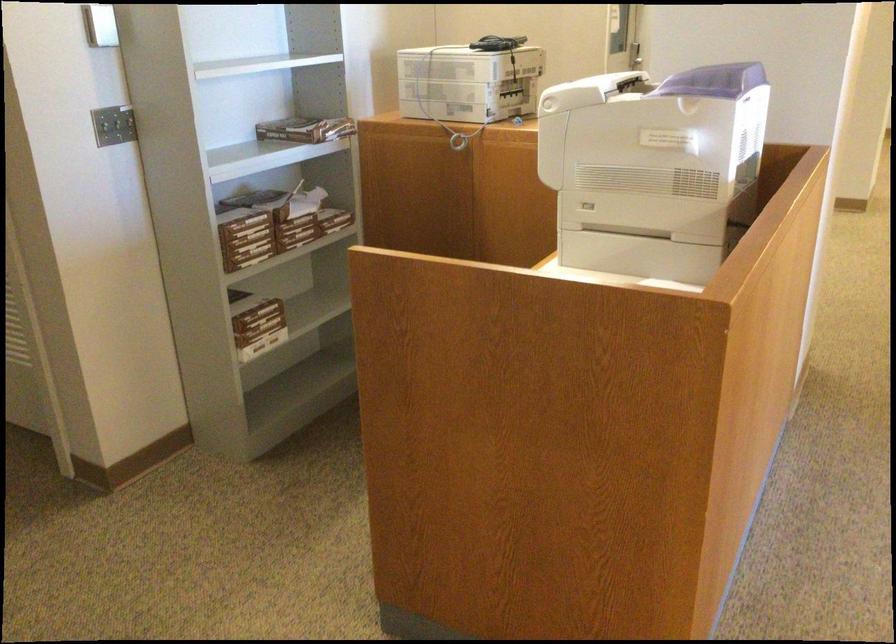
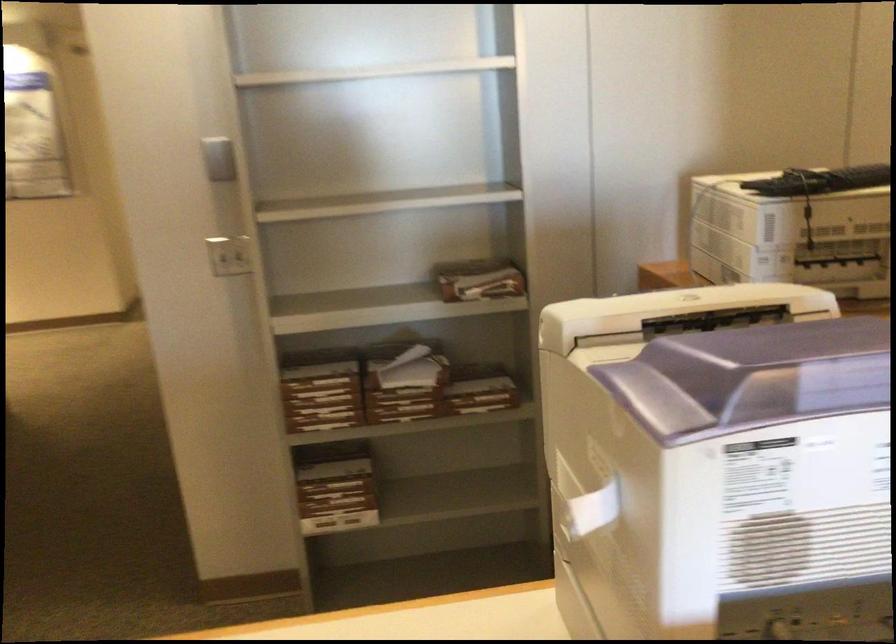
Locate, in the second image, the point that corresponds to point 96,131 in the first image.

(228, 254)